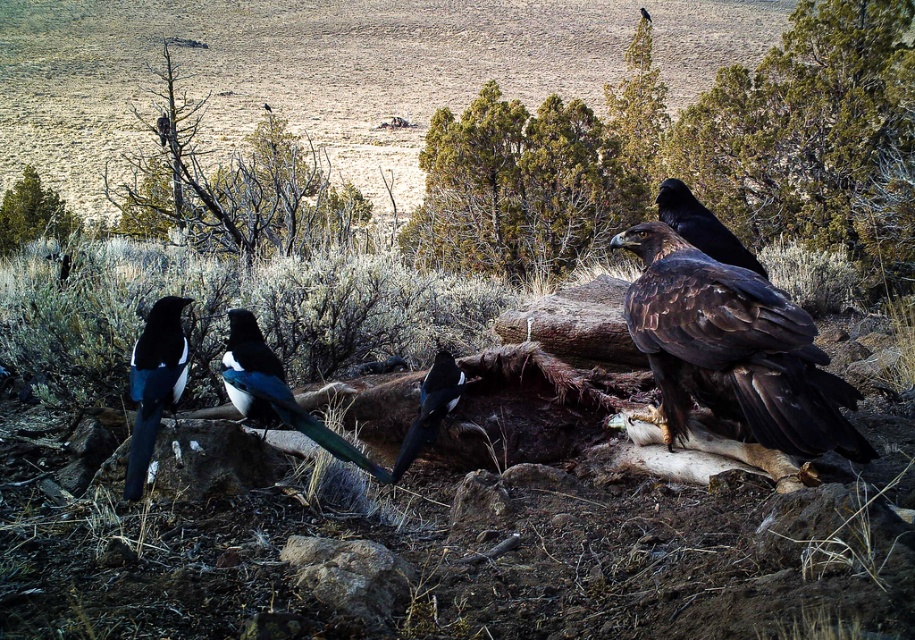
You are a hiker who has spotted the shiny brown eagle at center right. If you want to take a photo of it without moving, which direction should you face?

The shiny brown eagle at center right is located at point (733,349). To take a photo without moving, you should face towards the center right direction where the shiny brown eagle is positioned.

You are a photographer aiming to capture both the shiny brown eagle at center right and the black glossy vulture at center in a single frame. Based on their positions, which bird should you adjust your camera to focus on first to ensure both are in the shot?

The shiny brown eagle at center right is to the right of the black glossy vulture at center, so you should focus on the shiny brown eagle at center right first to ensure both are within the frame.